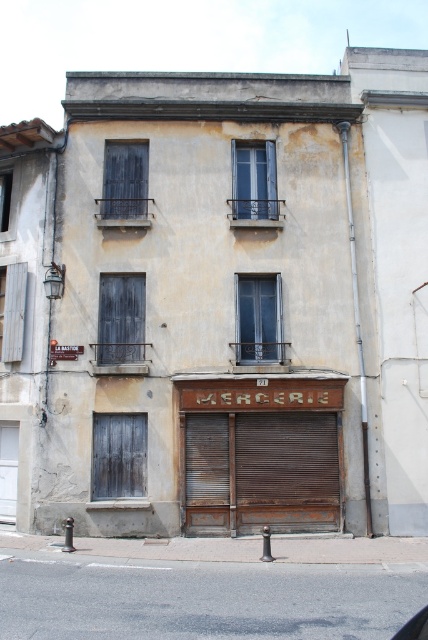
Between brown wooden garage door at center and wooden dark gray shutter at center, which one has more height?

brown wooden garage door at center is taller.

Can you confirm if brown wooden garage door at center is positioned to the right of wooden dark gray shutter at center?

Indeed, brown wooden garage door at center is positioned on the right side of wooden dark gray shutter at center.

Between point (240, 522) and point (261, 148), which one is positioned in front?

Point (240, 522) is more forward.

At what (x,y) coordinates should I click in order to perform the action: click on brown wooden garage door at center. Please return your answer as a coordinate pair (x, y). Looking at the image, I should click on (261, 472).

Is point (100, 337) in front of point (225, 464)?

That is False.

At what (x,y) coordinates should I click in order to perform the action: click on dark wood shutter at left. Please return your answer as a coordinate pair (x, y). Looking at the image, I should click on (121, 317).

Describe the element at coordinates (121, 317) in the screenshot. I see `dark wood shutter at left` at that location.

Image resolution: width=428 pixels, height=640 pixels. Identify the location of dark wood shutter at left. (121, 317).

Looking at this image, does brown wooden garage door at center have a larger size compared to gray wood door at lower left?

Yes, brown wooden garage door at center is bigger than gray wood door at lower left.

Which is in front, point (249, 516) or point (130, 452)?

Point (249, 516) is more forward.

Where is `brown wooden garage door at center`? The height and width of the screenshot is (640, 428). brown wooden garage door at center is located at coordinates tap(261, 472).